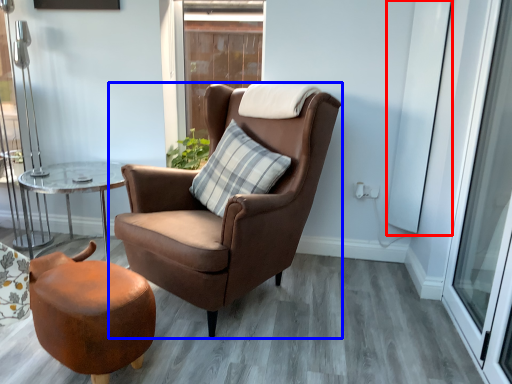
Question: Which object is further to the camera taking this photo, screen door (highlighted by a red box) or chair (highlighted by a blue box)?

Choices:
 (A) screen door
 (B) chair

Answer: (A)